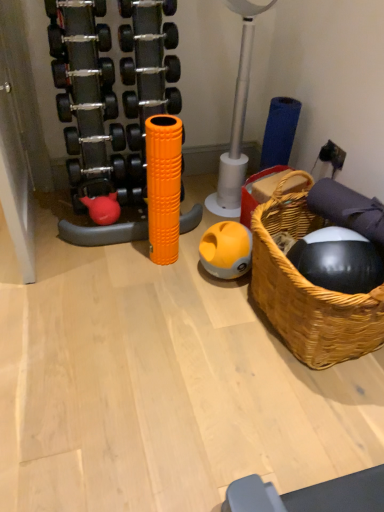
Question: Is orange foam roller at center thinner than yellow matte ball at center?

Choices:
 (A) no
 (B) yes

Answer: (B)

Question: Is yellow matte ball at center surrounded by orange foam roller at center?

Choices:
 (A) yes
 (B) no

Answer: (B)

Question: Considering the relative sizes of orange foam roller at center and yellow matte ball at center in the image provided, is orange foam roller at center shorter than yellow matte ball at center?

Choices:
 (A) no
 (B) yes

Answer: (A)

Question: Considering the relative sizes of orange foam roller at center and yellow matte ball at center in the image provided, is orange foam roller at center bigger than yellow matte ball at center?

Choices:
 (A) yes
 (B) no

Answer: (A)

Question: Can you confirm if orange foam roller at center is wider than yellow matte ball at center?

Choices:
 (A) yes
 (B) no

Answer: (B)

Question: From the image's perspective, relative to yellow matte ball at center, is orange foam roller at center above or below?

Choices:
 (A) above
 (B) below

Answer: (A)

Question: Does point (147, 138) appear closer or farther from the camera than point (230, 266)?

Choices:
 (A) farther
 (B) closer

Answer: (B)

Question: From a real-world perspective, relative to yellow matte ball at center, is orange foam roller at center vertically above or below?

Choices:
 (A) above
 (B) below

Answer: (A)

Question: In terms of width, does orange foam roller at center look wider or thinner when compared to yellow matte ball at center?

Choices:
 (A) thin
 (B) wide

Answer: (A)

Question: Considering the relative positions of yellow matte ball at center and orange foam roller at center in the image provided, is yellow matte ball at center to the left or to the right of orange foam roller at center?

Choices:
 (A) right
 (B) left

Answer: (A)

Question: Considering the positions of yellow matte ball at center and orange foam roller at center in the image, is yellow matte ball at center wider or thinner than orange foam roller at center?

Choices:
 (A) wide
 (B) thin

Answer: (A)

Question: From the image's perspective, is yellow matte ball at center above or below orange foam roller at center?

Choices:
 (A) below
 (B) above

Answer: (A)

Question: Is yellow matte ball at center inside or outside of orange foam roller at center?

Choices:
 (A) inside
 (B) outside

Answer: (B)

Question: Visually, is orange foam roller at center positioned to the left or to the right of woven wood basket at right?

Choices:
 (A) right
 (B) left

Answer: (B)

Question: Relative to woven wood basket at right, is orange foam roller at center in front or behind?

Choices:
 (A) front
 (B) behind

Answer: (B)